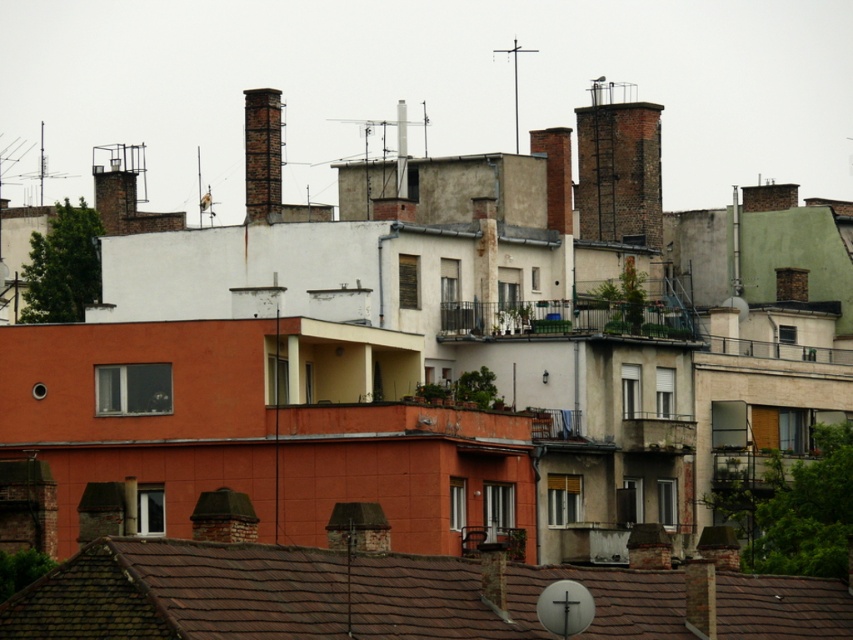
You are standing on the ground floor of a building and looking up at the rooftops. You see the brown tile roof at lower center and the brick chimney at upper center. Which object is taller from your viewpoint?

The brick chimney at upper center is taller than the brown tile roof at lower center.

You are a drone operator trying to locate a specific rooftop. You have a map showing coordinates. According to the map, the brown tile roof at lower center is located at which coordinates?

The brown tile roof at lower center is located at coordinates point (390,596).